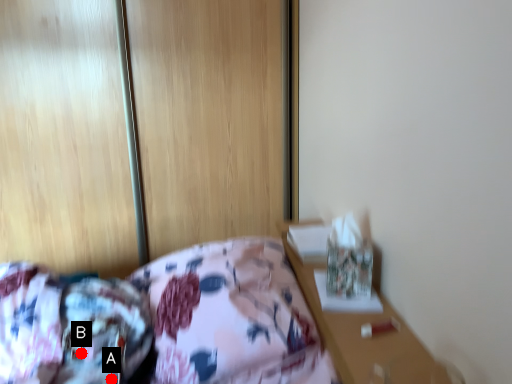
Question: Two points are circled on the image, labeled by A and B beside each circle. Which point appears farthest from the camera in this image?

Choices:
 (A) A is further
 (B) B is further

Answer: (B)